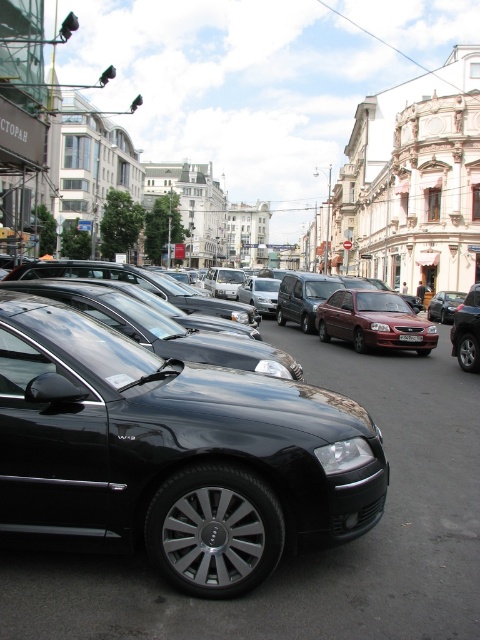
Is glossy black car at center to the right of white plastic license plate at center from the viewer's perspective?

In fact, glossy black car at center is to the left of white plastic license plate at center.

Which is more to the right, glossy black car at center or white plastic license plate at center?

white plastic license plate at center

Is point (196, 396) in front of point (418, 333)?

Yes, it is.

Identify the location of glossy black car at center. The image size is (480, 640). (180, 458).